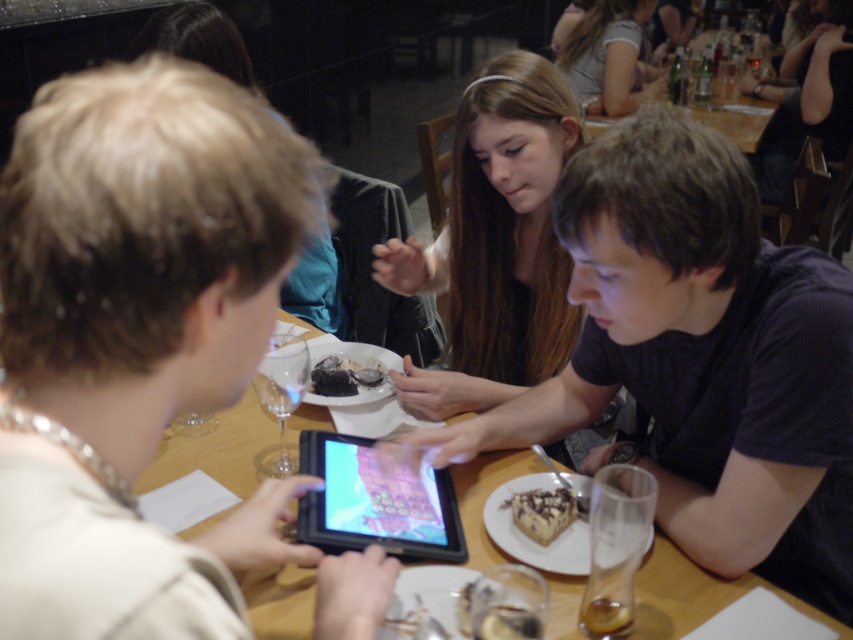
Is black glossy tablet at center wider than striped cotton shirt at upper center?

No.

Is point (398, 474) more distant than point (619, 90)?

No.

Is point (305, 525) positioned behind point (656, 86)?

No, it is not.

I want to click on black glossy tablet at center, so click(x=374, y=502).

Is smooth black shirt at center below chocolate cake with frosting at center?

Incorrect, smooth black shirt at center is not positioned below chocolate cake with frosting at center.

Is point (477, 268) closer to camera compared to point (339, 392)?

No, (477, 268) is behind (339, 392).

You are a GUI agent. You are given a task and a screenshot of the screen. Output one action in this format:
    pyautogui.click(x=<x>, y=<y>)
    Task: Click on the smooth black shirt at center
    The image size is (853, 640).
    Given the screenshot: What is the action you would take?
    pyautogui.click(x=495, y=243)

Can you confirm if wooden table at center is wider than chocolate frosted cake at lower center?

Yes, wooden table at center is wider than chocolate frosted cake at lower center.

Measure the distance between wooden table at center and chocolate frosted cake at lower center.

The distance of wooden table at center from chocolate frosted cake at lower center is 8.55 inches.

Where is `wooden table at center`? wooden table at center is located at coordinates point(693,595).